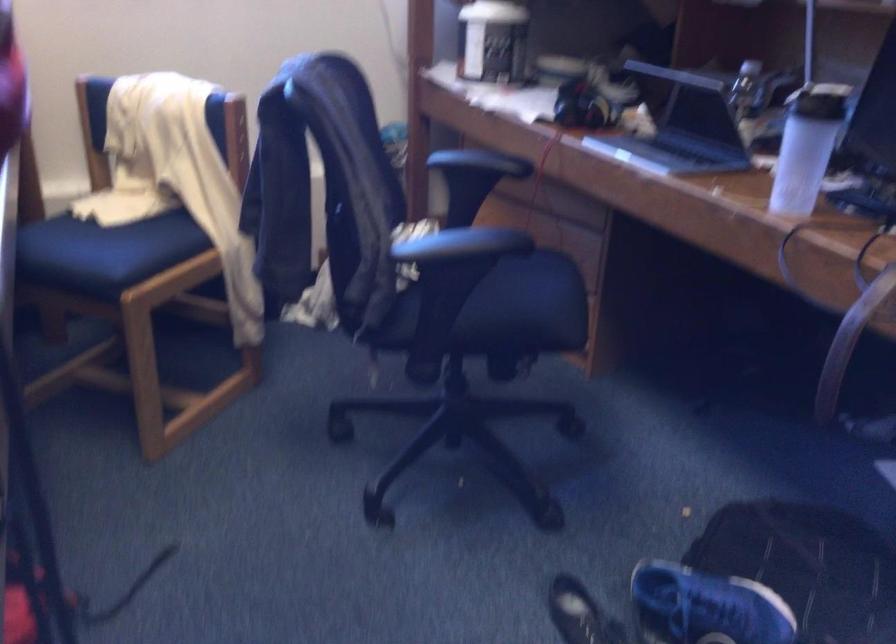
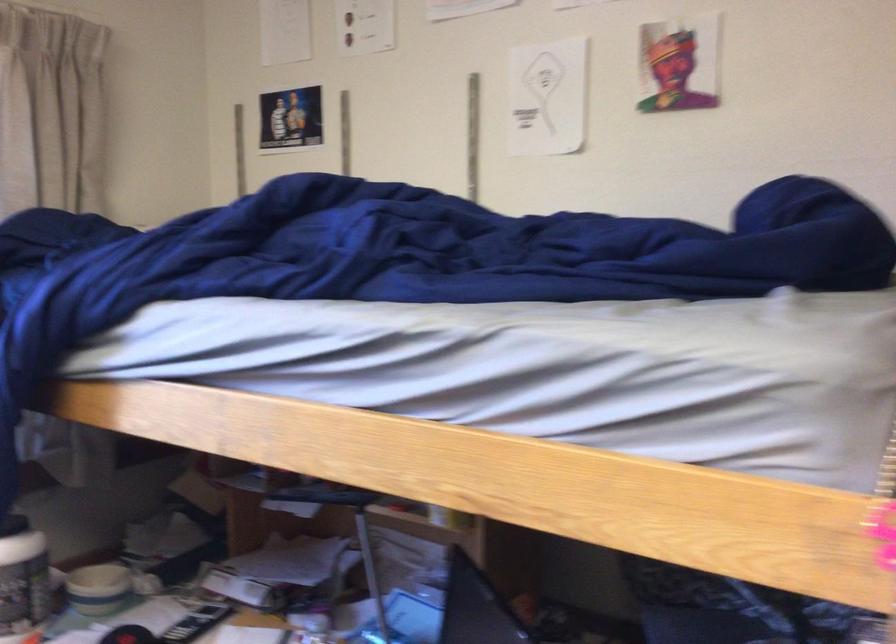
The first image is from the beginning of the video and the second image is from the end. How did the camera likely rotate when shooting the video?

The camera's rotation is toward right-up.